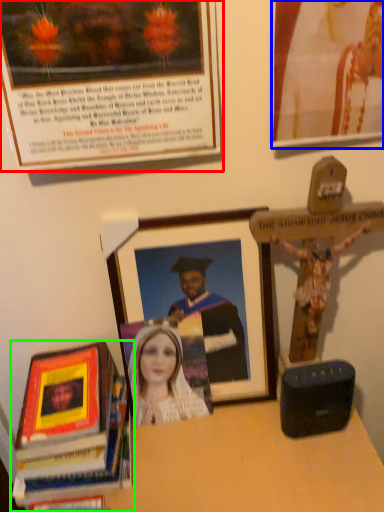
Question: Which is farther away from picture frame (highlighted by a red box)? picture frame (highlighted by a blue box) or book (highlighted by a green box)?

Choices:
 (A) picture frame
 (B) book

Answer: (B)